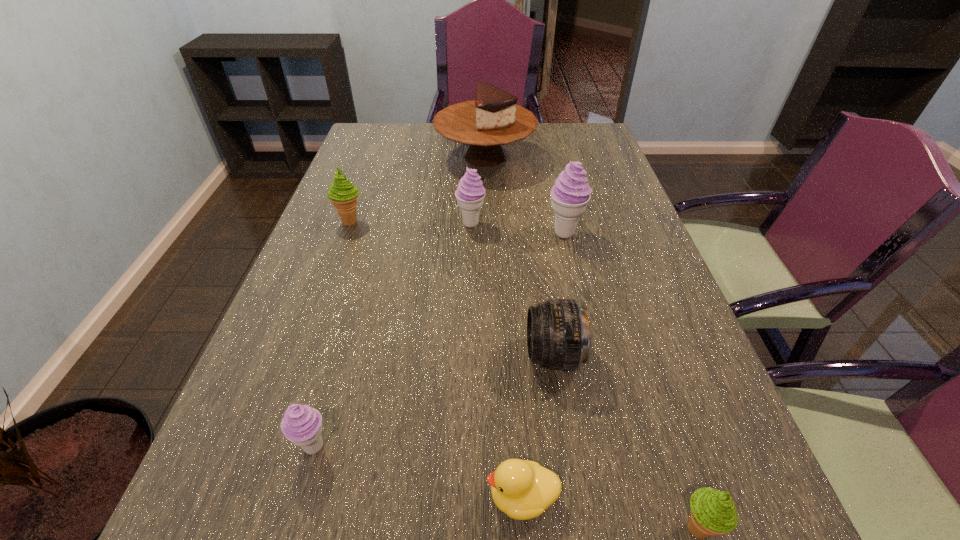
I want to click on icecream that is the third closest to the leftmost icecream, so click(x=302, y=425).

This screenshot has height=540, width=960. Find the location of `icecream that is the third closest to the fifth farthest object`. icecream that is the third closest to the fifth farthest object is located at coordinates (470, 193).

This screenshot has height=540, width=960. In order to click on purple icecream that stands as the closest to the second biggest purple icecream in this screenshot , I will do `click(571, 193)`.

I want to click on purple icecream object that ranks as the second closest to the duckling, so click(x=571, y=193).